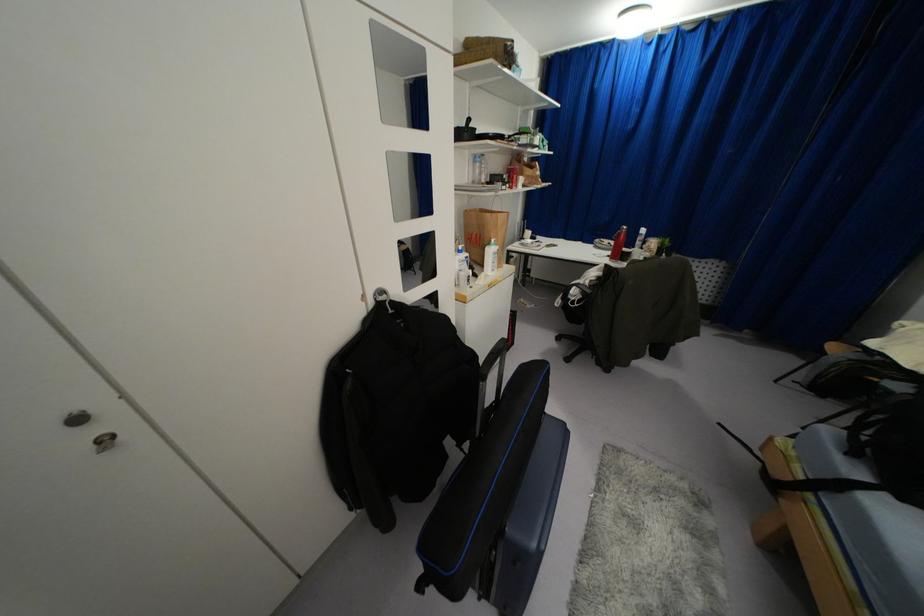
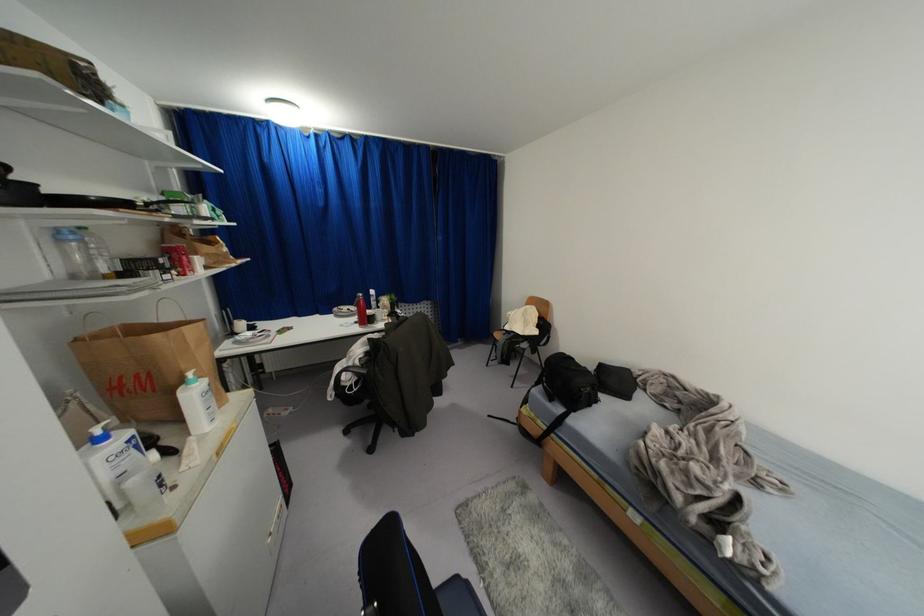
Where in the second image is the point corresponding to pixel 492 240 from the first image?

(189, 374)